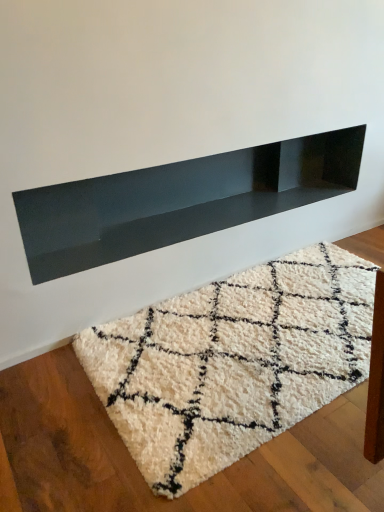
Question: From a real-world perspective, is white shaggy rug at center physically located above or below glossy black shelf at upper center?

Choices:
 (A) above
 (B) below

Answer: (B)

Question: Looking at their shapes, would you say white shaggy rug at center is wider or thinner than glossy black shelf at upper center?

Choices:
 (A) thin
 (B) wide

Answer: (B)

Question: Choose the correct answer: Is white shaggy rug at center inside glossy black shelf at upper center or outside it?

Choices:
 (A) outside
 (B) inside

Answer: (A)

Question: Is point (36, 220) positioned closer to the camera than point (124, 326)?

Choices:
 (A) closer
 (B) farther

Answer: (A)

Question: From a real-world perspective, is glossy black shelf at upper center physically located above or below white shaggy rug at center?

Choices:
 (A) below
 (B) above

Answer: (B)

Question: From their relative heights in the image, would you say glossy black shelf at upper center is taller or shorter than white shaggy rug at center?

Choices:
 (A) short
 (B) tall

Answer: (B)

Question: Based on their sizes in the image, would you say glossy black shelf at upper center is bigger or smaller than white shaggy rug at center?

Choices:
 (A) small
 (B) big

Answer: (B)